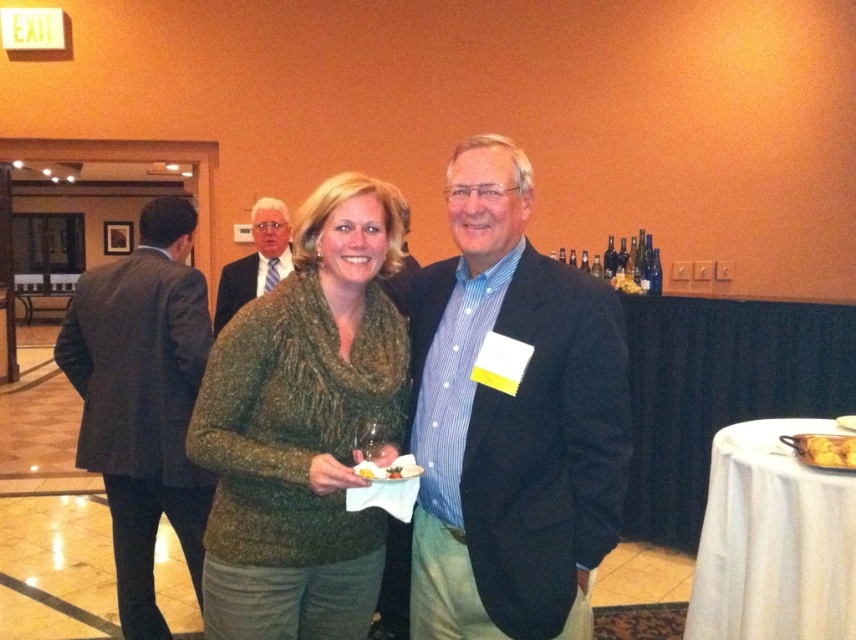
Based on the coordinates provided, which object is located at point (510, 420) in the image?

The blue striped shirt at center is located at point (510, 420).

You are standing at the center of the banquet hall and see the point marked at coordinates (507, 420). Based on the scene description, which object does this point most likely lie on?

The point at coordinates (507, 420) is on the green textured sweater at center.

You are at a social event and want to place your drink on the yellow matte plate at center. However, you notice the green textured sweater at center is in the way. Can you place your drink on the plate without moving the sweater?

The green textured sweater at center is much taller than the yellow matte plate at center, so placing the drink on the plate might be difficult as the sweater could block access or stability.